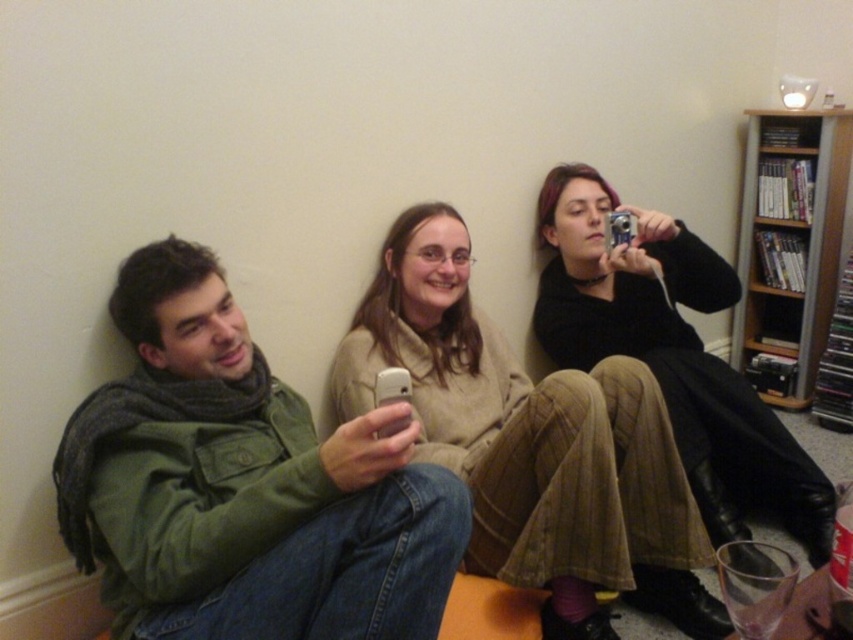
Between matte black camera at center and wooden bookshelf at upper right, which one is positioned lower?

matte black camera at center is below.

Can you confirm if matte black camera at center is bigger than wooden bookshelf at upper right?

Correct, matte black camera at center is larger in size than wooden bookshelf at upper right.

Who is more distant from viewer, (635, 340) or (762, 394)?

The point (762, 394) is more distant.

At what (x,y) coordinates should I click in order to perform the action: click on matte black camera at center. Please return your answer as a coordinate pair (x, y). This screenshot has height=640, width=853. Looking at the image, I should click on (672, 355).

Is matte green jacket at left thinner than beige corduroy pants at center?

Correct, matte green jacket at left's width is less than beige corduroy pants at center's.

From the picture: Which of these two, matte green jacket at left or beige corduroy pants at center, stands taller?

beige corduroy pants at center

Does point (235, 636) come behind point (625, 525)?

No, (235, 636) is closer to viewer.

I want to click on matte green jacket at left, so click(x=242, y=484).

Which is in front, point (166, 508) or point (779, 132)?

Point (166, 508) is in front.

Who is more distant from viewer, [457,532] or [824,317]?

Point [824,317]

What are the coordinates of `matte green jacket at left` in the screenshot? It's located at (242, 484).